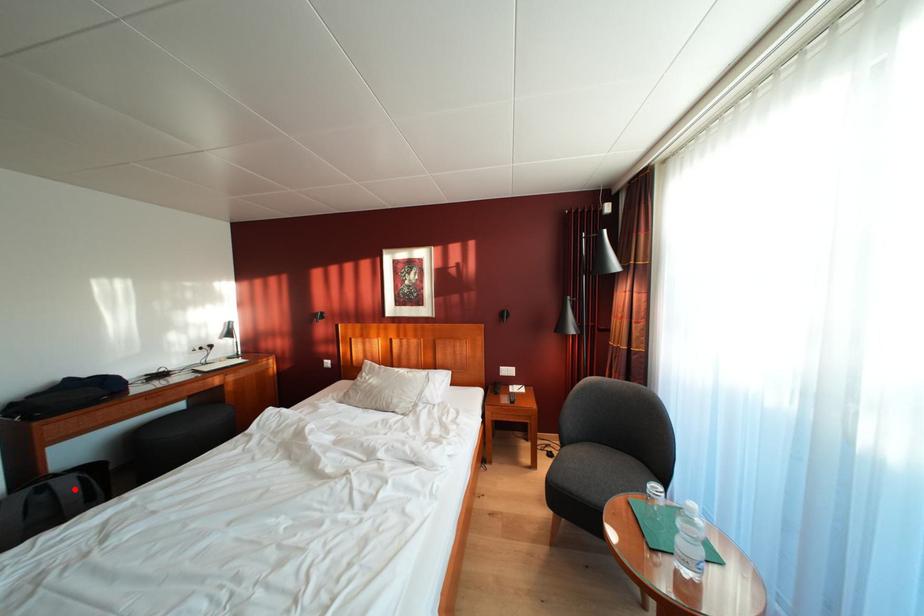
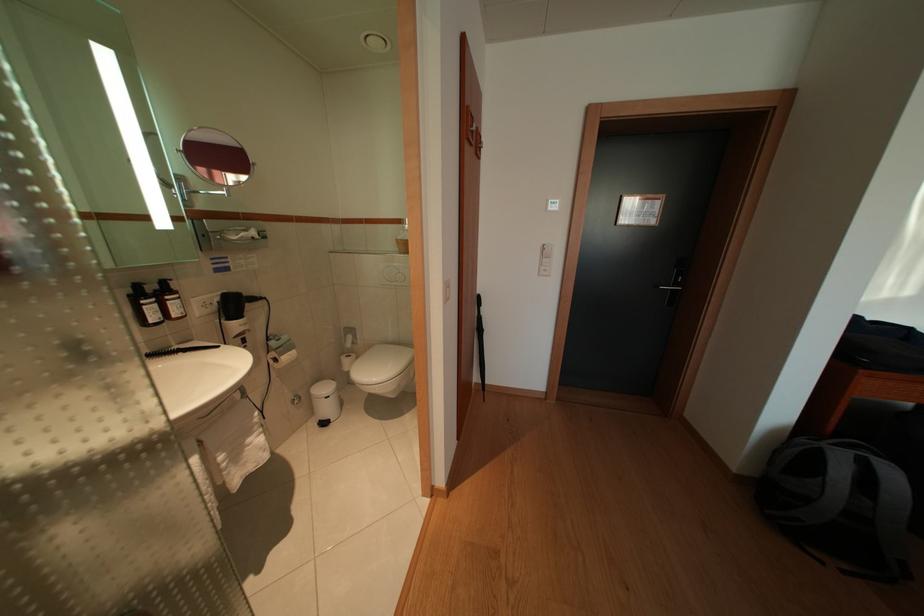
Question: A red point is marked in image1. In image2, is the corresponding 3D point closer to the camera or farther? Reply with the corresponding letter.

Choices:
 (A) The corresponding 3D point is closer.
 (B) The corresponding 3D point is farther.

Answer: (A)